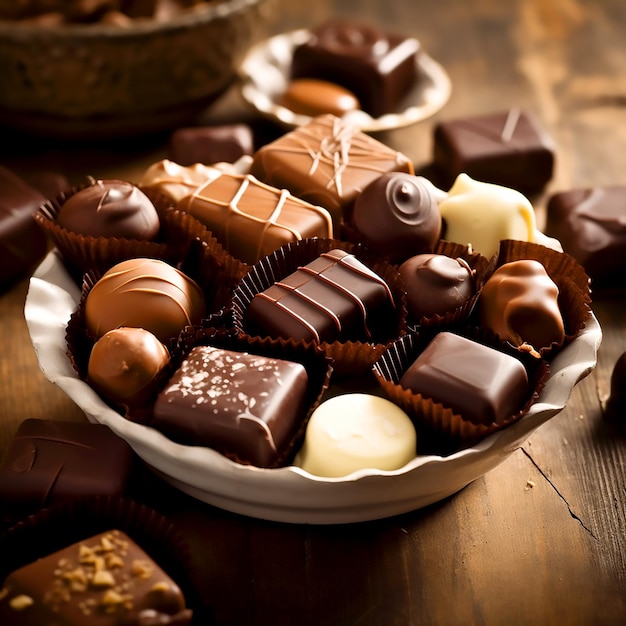
Image resolution: width=626 pixels, height=626 pixels. Find the location of `unwrapped chocolates in bowl`. unwrapped chocolates in bowl is located at coordinates (314, 105), (370, 64).